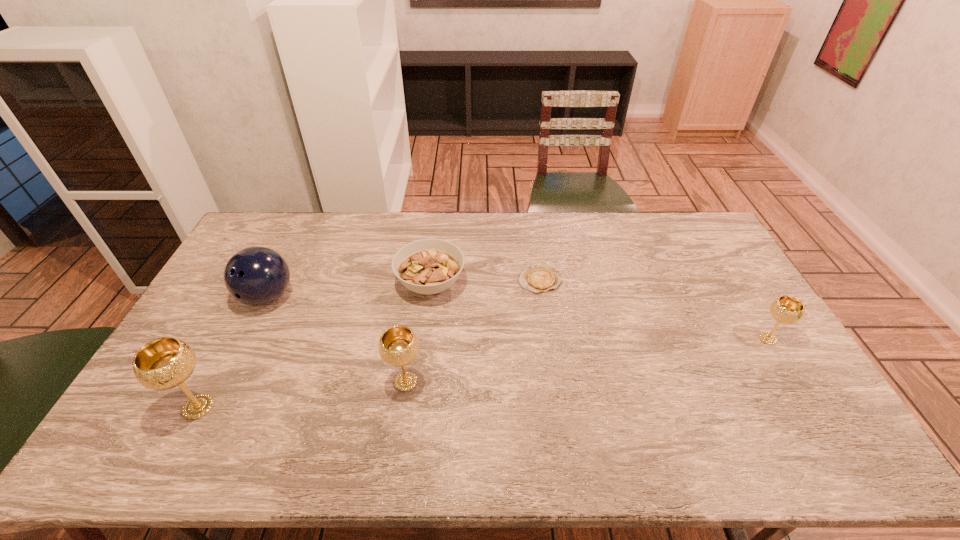
To achieve uniform spacing by inserting another chalice among them, please point to a free space for this new chalice. Please provide its 2D coordinates. Your answer should be formatted as a tuple, i.e. [(x, y)], where the tuple contains the x and y coordinates of a point satisfying the conditions above.

[(595, 359)]